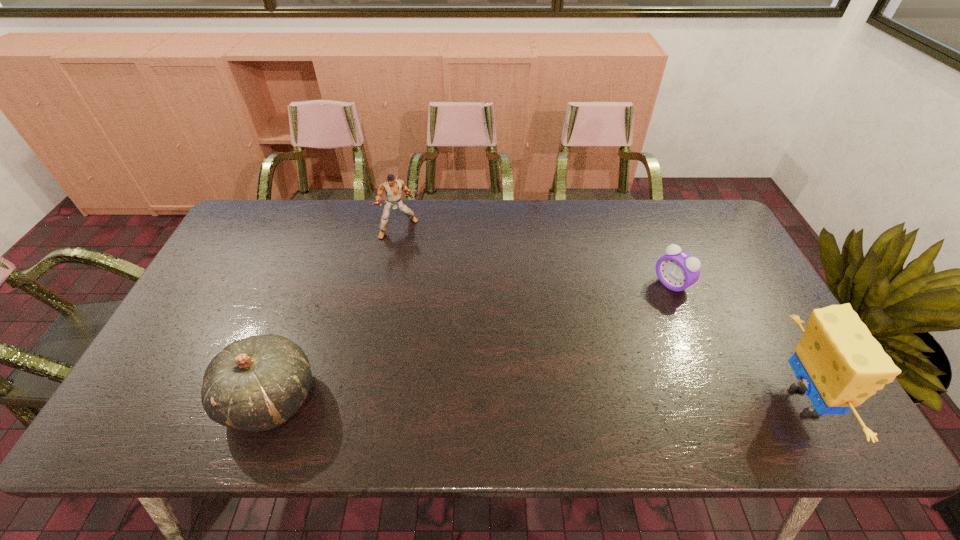
The height and width of the screenshot is (540, 960). Find the location of `vacant spot on the desktop that is between the gourd and the rightmost object and is positioned on the face of the third object from left to right`. vacant spot on the desktop that is between the gourd and the rightmost object and is positioned on the face of the third object from left to right is located at coordinates (485, 400).

Where is `vacant space on the desktop that is between the second shortest object and the sponge and is positioned on the front-facing side of the farthest object`? The image size is (960, 540). vacant space on the desktop that is between the second shortest object and the sponge and is positioned on the front-facing side of the farthest object is located at coordinates (503, 400).